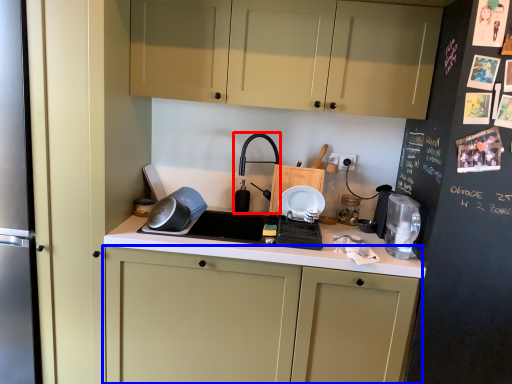
Question: Which object appears closest to the camera in this image, faucet (highlighted by a red box) or cabinetry (highlighted by a blue box)?

Choices:
 (A) faucet
 (B) cabinetry

Answer: (B)